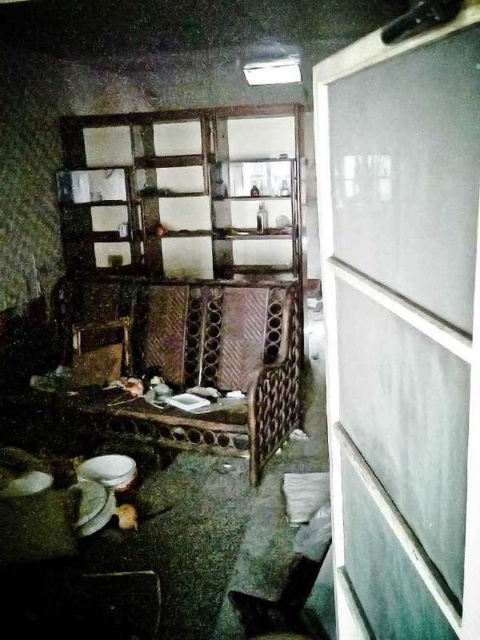
Question: Can you confirm if clear plastic screen door at right is positioned to the left of white glossy plate at lower left?

Choices:
 (A) yes
 (B) no

Answer: (B)

Question: Can you confirm if white glossy plate at lower left is thinner than white matte plate at lower left?

Choices:
 (A) no
 (B) yes

Answer: (A)

Question: Which of the following is the closest to the observer?

Choices:
 (A) (29, 474)
 (B) (421, 301)
 (C) (106, 474)

Answer: (B)

Question: Considering the real-world distances, which object is farthest from the white matte plate at lower left?

Choices:
 (A) white glossy plate at lower left
 (B) clear plastic screen door at right

Answer: (B)

Question: Does white glossy plate at lower left appear on the left side of white matte plate at lower left?

Choices:
 (A) yes
 (B) no

Answer: (B)

Question: Which object is positioned closest to the clear plastic screen door at right?

Choices:
 (A) white matte plate at lower left
 (B) white glossy plate at lower left

Answer: (B)